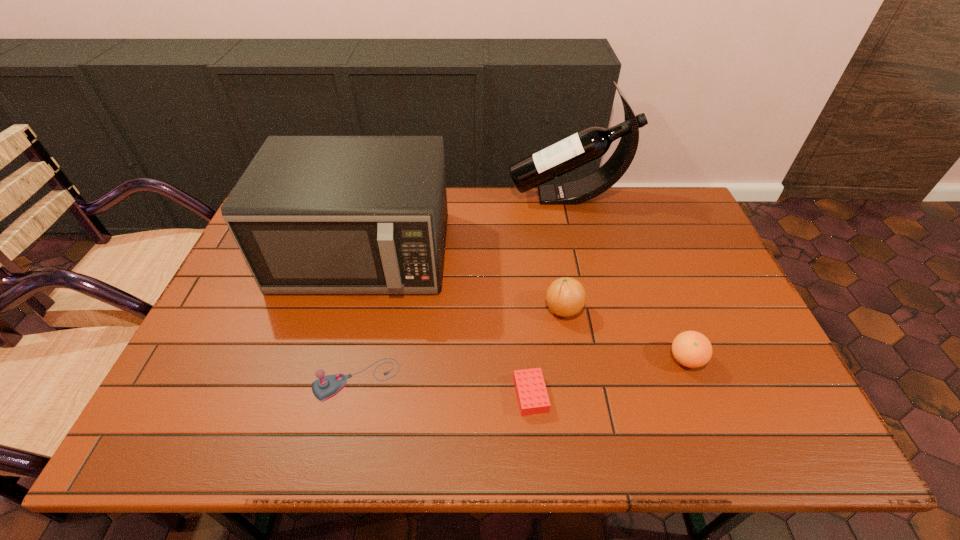
Locate an element on the screen. free space between the joystick and the taller orange is located at coordinates (460, 345).

You are a GUI agent. You are given a task and a screenshot of the screen. Output one action in this format:
    pyautogui.click(x=<x>, y=<y>)
    Task: Click on the empty space between the joystick and the shortest object
    This screenshot has width=960, height=540.
    Given the screenshot: What is the action you would take?
    pyautogui.click(x=444, y=388)

Image resolution: width=960 pixels, height=540 pixels. Identify the location of free spot between the nearer orange and the tallest object. (627, 278).

Locate an element on the screen. This screenshot has width=960, height=540. free space between the shortest object and the taller orange is located at coordinates (547, 352).

This screenshot has height=540, width=960. Find the location of `empty space between the Lego and the left orange`. empty space between the Lego and the left orange is located at coordinates (547, 352).

At what (x,y) coordinates should I click in order to perform the action: click on empty space that is in between the Lego and the second tallest object. Please return your answer as a coordinate pair (x, y). The width and height of the screenshot is (960, 540). Looking at the image, I should click on [446, 324].

Find the location of a particular element. The height and width of the screenshot is (540, 960). unoccupied position between the tallest object and the fourth shortest object is located at coordinates (565, 253).

This screenshot has width=960, height=540. Identify the location of free space between the joystick and the microwave oven. (360, 317).

You are a GUI agent. You are given a task and a screenshot of the screen. Output one action in this format:
    pyautogui.click(x=<x>, y=<y>)
    Task: Click on the closest object to the joystick
    
    Given the screenshot: What is the action you would take?
    point(311,214)

Identify which object is located as the second nearest to the joystick. Please provide its 2D coordinates. Your answer should be formatted as a tuple, i.e. [(x, y)], where the tuple contains the x and y coordinates of a point satisfying the conditions above.

[(532, 396)]